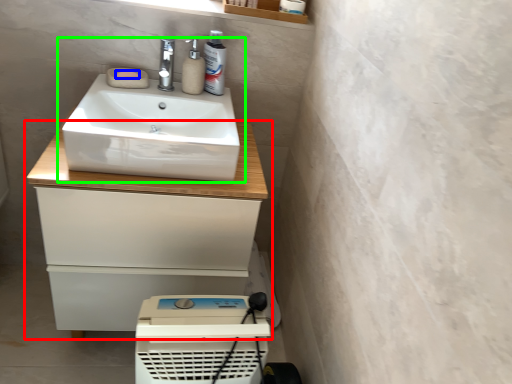
Question: Based on their relative distances, which object is nearer to bathroom cabinet (highlighted by a red box)? Choose from soap (highlighted by a blue box) and sink (highlighted by a green box).

Choices:
 (A) soap
 (B) sink

Answer: (B)